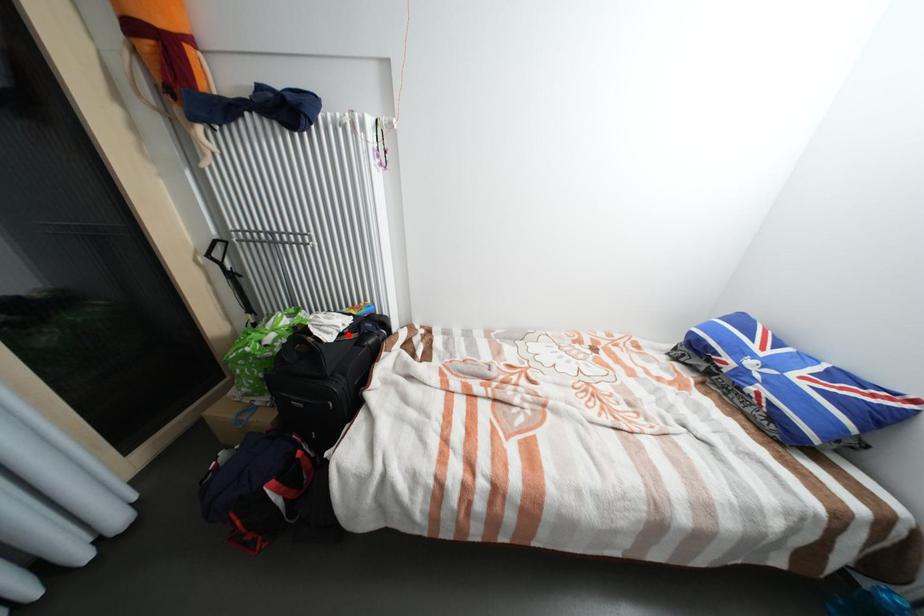
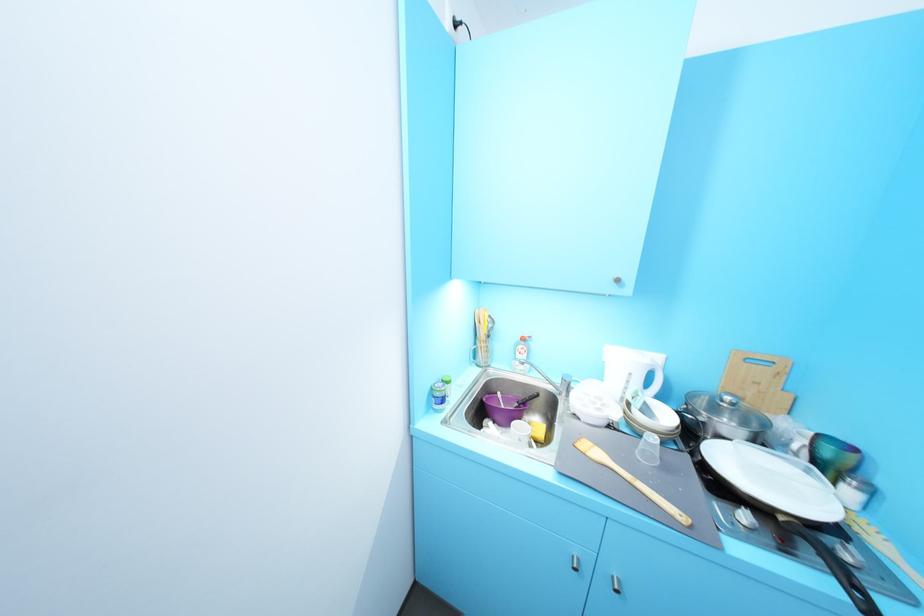
Question: I am providing you with two images of the same scene from different viewpoints. A red point is marked on the first image. At the location where the point appears in image 1, is it still visible in image 2?

Choices:
 (A) Yes
 (B) No

Answer: (B)